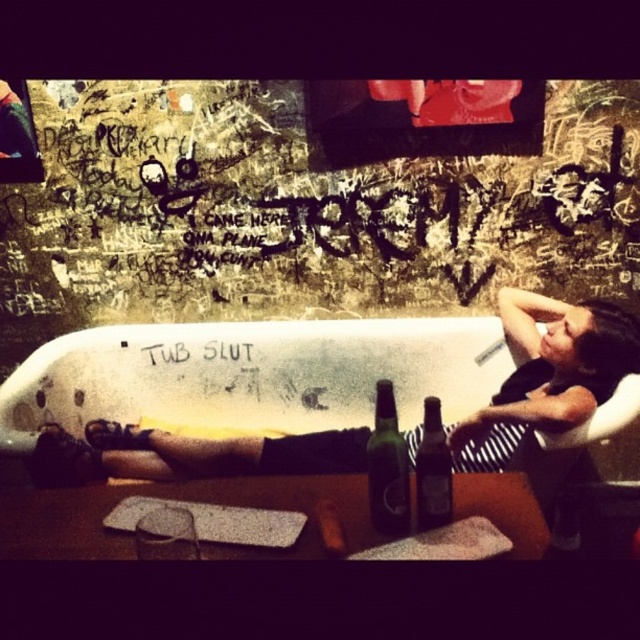
You are a bartender who needs to grab a bottle for a customer. You see a green glass bottle at center and a brown glass bottle at center. Which one is on the left side?

The green glass bottle at center is on the left side of the brown glass bottle at center.

You are a photographer trying to capture the graffiti on the wall and the bathtub scene. You notice the black fabric shirt at center and the green glass bottle at center. Which object should you focus on if you want to capture the larger item in your shot?

The black fabric shirt at center has a larger size compared to the green glass bottle at center, so you should focus on the black fabric shirt at center to capture the larger item in your shot.

You are a photographer trying to capture the graffiti on the wall and the objects in the bathtub. You notice the black fabric shirt at center and the brown glass bottle at center. Which object would appear larger in your photo if you focus on them equally?

The black fabric shirt at center would appear larger in the photo since it is much taller than the brown glass bottle at center.